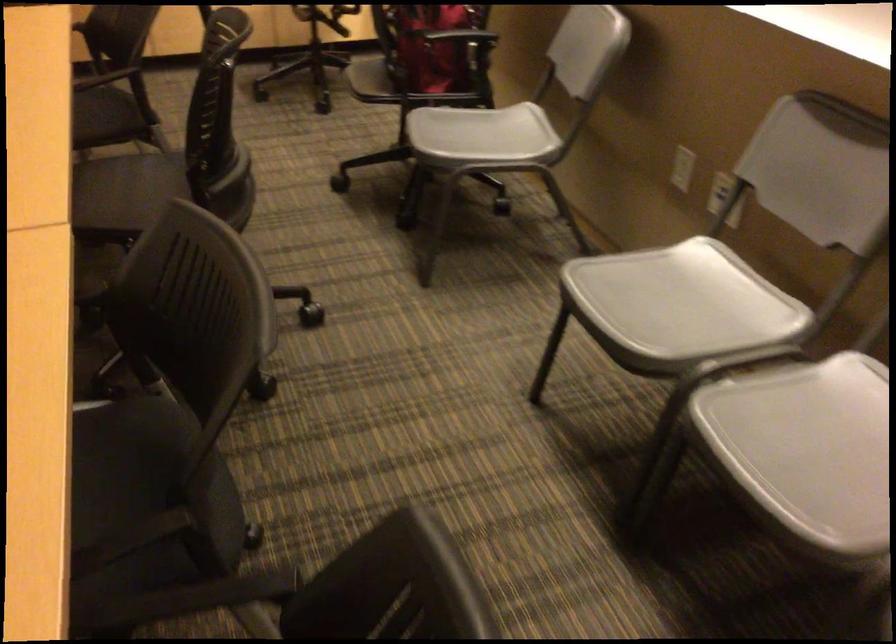
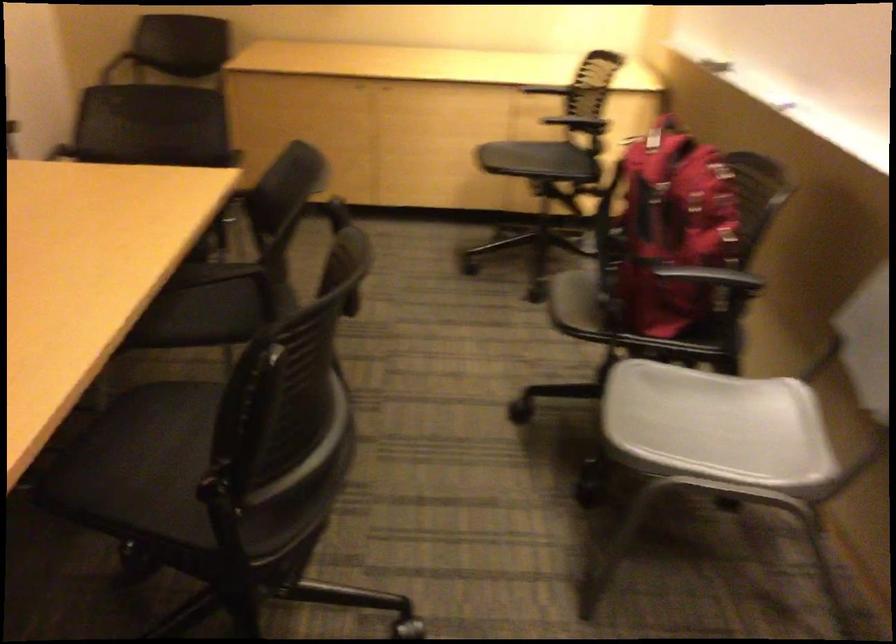
Question: The images are taken continuously from a first-person perspective. In which direction is your viewpoint rotating?

Choices:
 (A) Left
 (B) Right
 (C) Up
 (D) Down

Answer: (A)